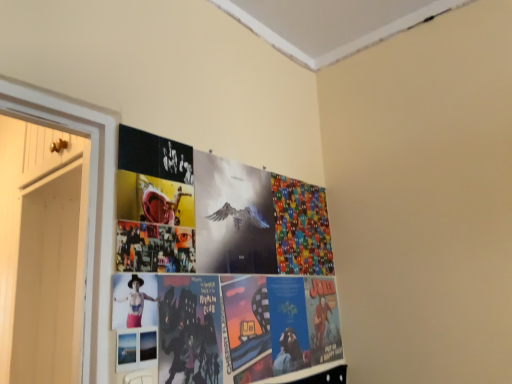
What do you see at coordinates (41, 253) in the screenshot?
I see `white wood door at left` at bounding box center [41, 253].

Find the location of a particular element. metallic silver poster at center, placed as the 1th flyer when sorted from front to back is located at coordinates tap(233, 217).

Which is closer to the camera, (119, 285) or (247, 180)?

Point (119, 285) is positioned closer to the camera compared to point (247, 180).

Do you think matte black person at center is within metallic silver poster at center, the second flyer when ordered from right to left, or outside of it?

The correct answer is: outside.

Is matte black person at center not near metallic silver poster at center, which ranks as the second flyer in back-to-front order?

They are positioned close to each other.

From a real-world perspective, which is physically below, matte black person at center or white wood door at left?

matte black person at center is physically lower.

Which object is wider, matte black person at center or white wood door at left?

white wood door at left.

From the image's perspective, is matte black person at center under white wood door at left?

No.

Considering the relative positions of matte black person at center and white wood door at left in the image provided, is matte black person at center behind white wood door at left?

That is False.

From a real-world perspective, does white wood door at left stand above matte black person at center?

Yes.

Is matte black person at center completely or partially inside white wood door at left?

Definitely not — matte black person at center is not inside white wood door at left.

Is white wood door at left positioned with its back to matte black person at center?

white wood door at left does not have its back to matte black person at center.

Can you confirm if white wood door at left is wider than matte black person at center?

Yes, white wood door at left is wider than matte black person at center.

Is multicolored fabric at upper right, which appears as the first flyer when viewed from the right, at the right side of white wood door at left?

Yes, multicolored fabric at upper right, which appears as the first flyer when viewed from the right, is to the right of white wood door at left.

From the image's perspective, is multicolored fabric at upper right, which appears as the 1th flyer when viewed from the back, on top of white wood door at left?

Indeed, from the image's perspective, multicolored fabric at upper right, which appears as the 1th flyer when viewed from the back, is shown above white wood door at left.

The height and width of the screenshot is (384, 512). I want to click on the 1st flyer above when counting from the white wood door at left (from the image's perspective), so click(x=301, y=227).

From a real-world perspective, is multicolored fabric at upper right, which is the second flyer in front-to-back order, located beneath white wood door at left?

No, from a real-world perspective, multicolored fabric at upper right, which is the second flyer in front-to-back order, is not beneath white wood door at left.

Is point (246, 182) in front of point (132, 280)?

That is False.

From a real-world perspective, is metallic silver poster at center, marked as the first flyer in a left-to-right arrangement, physically below matte black person at center?

No.

Between metallic silver poster at center, marked as the first flyer in a left-to-right arrangement, and matte black person at center, which one has more height?

With more height is metallic silver poster at center, marked as the first flyer in a left-to-right arrangement.

How much distance is there between metallic silver poster at center, the second flyer when ordered from right to left, and matte black person at center?

metallic silver poster at center, the second flyer when ordered from right to left, is 13.43 inches away from matte black person at center.

Is metallic silver poster at center, the second flyer when ordered from right to left, aimed at white wood door at left?

No, metallic silver poster at center, the second flyer when ordered from right to left, does not turn towards white wood door at left.

Is metallic silver poster at center, marked as the first flyer in a left-to-right arrangement, next to white wood door at left and touching it?

No, metallic silver poster at center, marked as the first flyer in a left-to-right arrangement, is not making contact with white wood door at left.

In terms of width, does metallic silver poster at center, placed as the 1th flyer when sorted from front to back, look wider or thinner when compared to white wood door at left?

Considering their sizes, metallic silver poster at center, placed as the 1th flyer when sorted from front to back, looks slimmer than white wood door at left.

Would you say metallic silver poster at center, which ranks as the second flyer in back-to-front order, contains white wood door at left?

No.

Does white wood door at left have a lesser width compared to multicolored fabric at upper right, which is the second flyer in front-to-back order?

No.

Is point (34, 165) closer to viewer compared to point (294, 219)?

That is False.

In the scene shown: Who is bigger, white wood door at left or multicolored fabric at upper right, arranged as the 2th flyer when viewed from the left?

white wood door at left.

Could you tell me if white wood door at left is turned towards multicolored fabric at upper right, arranged as the 2th flyer when viewed from the left?

No.

Find the location of `flyer that is the 1st one when counting backward from the matte black person at center`. flyer that is the 1st one when counting backward from the matte black person at center is located at coordinates (233, 217).

Locate an element on the screen. person on the right of the white wood door at left is located at coordinates (134, 300).

From the image, which object appears to be farther from white wood door at left, metallic silver poster at center, which ranks as the second flyer in back-to-front order, or matte black person at center?

Based on the image, matte black person at center appears to be further to white wood door at left.

Considering their positions, is matte black person at center positioned closer to white wood door at left than multicolored fabric at upper right, arranged as the 2th flyer when viewed from the left?

matte black person at center is positioned closer to the anchor white wood door at left.

Considering their positions, is multicolored fabric at upper right, which appears as the 1th flyer when viewed from the back, positioned closer to metallic silver poster at center, marked as the first flyer in a left-to-right arrangement, than white wood door at left?

multicolored fabric at upper right, which appears as the 1th flyer when viewed from the back, is positioned closer to the anchor metallic silver poster at center, marked as the first flyer in a left-to-right arrangement.

Based on their spatial positions, is metallic silver poster at center, placed as the 1th flyer when sorted from front to back, or multicolored fabric at upper right, which appears as the 1th flyer when viewed from the back, closer to matte black person at center?

metallic silver poster at center, placed as the 1th flyer when sorted from front to back.

Looking at the image, which one is located further to multicolored fabric at upper right, arranged as the 2th flyer when viewed from the left, white wood door at left or matte black person at center?

white wood door at left.

When comparing their distances from multicolored fabric at upper right, which appears as the 1th flyer when viewed from the back, does metallic silver poster at center, the second flyer when ordered from right to left, or white wood door at left seem closer?

metallic silver poster at center, the second flyer when ordered from right to left, lies closer to multicolored fabric at upper right, which appears as the 1th flyer when viewed from the back, than the other object.

When comparing their distances from multicolored fabric at upper right, which appears as the 1th flyer when viewed from the back, does metallic silver poster at center, marked as the first flyer in a left-to-right arrangement, or matte black person at center seem closer?

metallic silver poster at center, marked as the first flyer in a left-to-right arrangement, lies closer to multicolored fabric at upper right, which appears as the 1th flyer when viewed from the back, than the other object.

Looking at this image, considering their positions, is matte black person at center positioned further to multicolored fabric at upper right, arranged as the 2th flyer when viewed from the left, than metallic silver poster at center, the second flyer when ordered from right to left?

matte black person at center lies further to multicolored fabric at upper right, arranged as the 2th flyer when viewed from the left, than the other object.

This screenshot has width=512, height=384. Find the location of `person between white wood door at left and metallic silver poster at center, marked as the first flyer in a left-to-right arrangement`. person between white wood door at left and metallic silver poster at center, marked as the first flyer in a left-to-right arrangement is located at coordinates (134, 300).

You are a GUI agent. You are given a task and a screenshot of the screen. Output one action in this format:
    pyautogui.click(x=<x>, y=<y>)
    Task: Click on the person located between white wood door at left and multicolored fabric at upper right, which is the second flyer in front-to-back order, in the left-right direction
    
    Given the screenshot: What is the action you would take?
    pyautogui.click(x=134, y=300)

Find the location of a particular element. flyer situated between white wood door at left and multicolored fabric at upper right, which appears as the first flyer when viewed from the right, from left to right is located at coordinates (233, 217).

At what (x,y) coordinates should I click in order to perform the action: click on flyer between matte black person at center and multicolored fabric at upper right, which is the second flyer in front-to-back order, along the z-axis. Please return your answer as a coordinate pair (x, y). Looking at the image, I should click on click(233, 217).